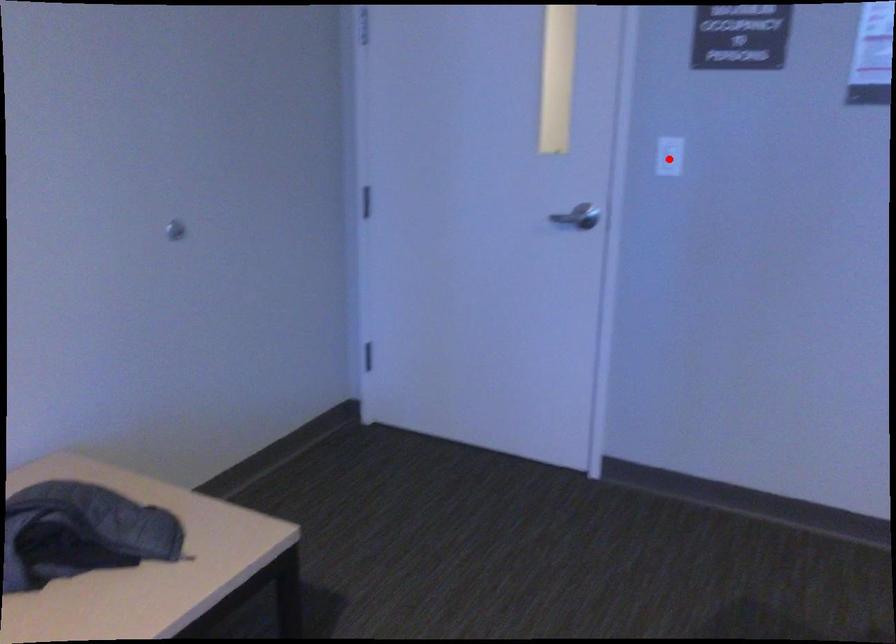
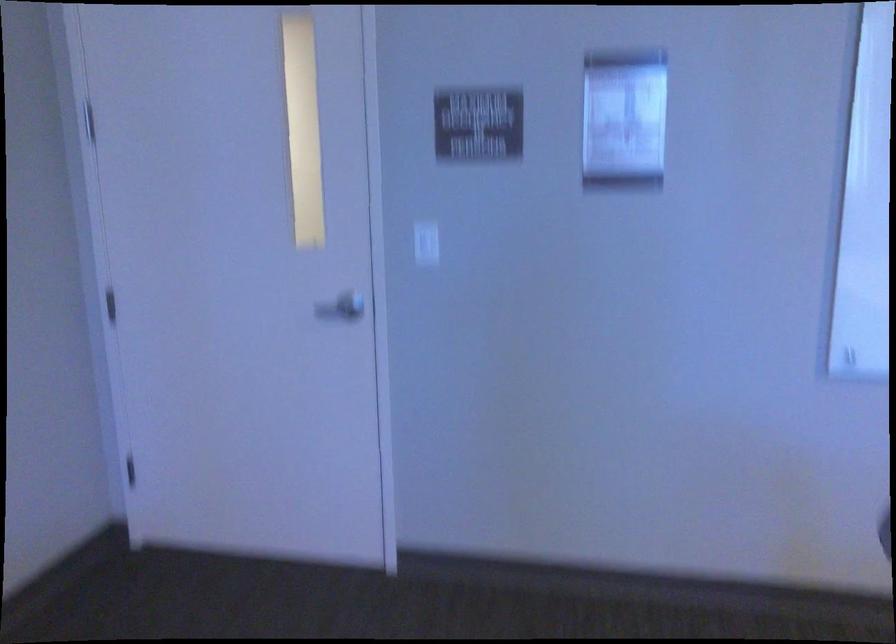
Find the pixel in the second image that matches the highlighted location in the first image.

(426, 243)